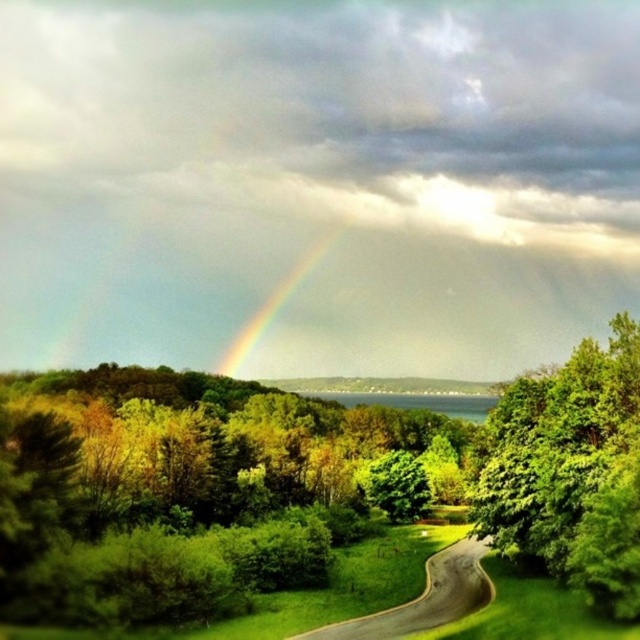
Question: Based on their relative distances, which object is nearer to the green leafy tree at center?

Choices:
 (A) green leafy tree at right
 (B) green asphalt road at center
 (C) rainbow at center

Answer: (A)

Question: Based on their relative distances, which object is farther from the green asphalt road at center?

Choices:
 (A) rainbow at center
 (B) green leafy tree at right
 (C) green leafy tree at center

Answer: (A)

Question: Which of these objects is positioned closest to the green asphalt road at center?

Choices:
 (A) green leafy tree at center
 (B) green leafy tree at right

Answer: (B)

Question: From the image, what is the correct spatial relationship of green leafy tree at right in relation to rainbow at center?

Choices:
 (A) above
 (B) below

Answer: (B)

Question: Is the position of green leafy tree at right less distant than that of rainbow at center?

Choices:
 (A) no
 (B) yes

Answer: (B)

Question: From the image, what is the correct spatial relationship of green leafy tree at center in relation to rainbow at center?

Choices:
 (A) below
 (B) above

Answer: (A)